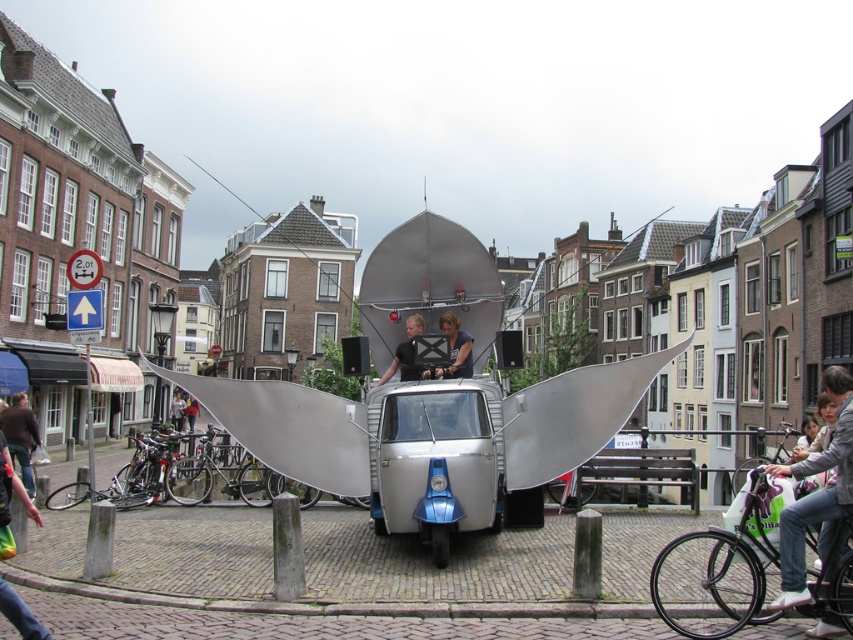
Question: Which object is farther from the camera taking this photo?

Choices:
 (A) black leather jacket at center
 (B) denim jeans at lower right
 (C) brushed metal bicycle at lower left
 (D) smooth silver wings at center

Answer: (A)

Question: Considering the relative positions of green matte bicycle at lower right and brushed metal bicycle at lower left in the image provided, where is green matte bicycle at lower right located with respect to brushed metal bicycle at lower left?

Choices:
 (A) above
 (B) below

Answer: (B)

Question: Which point appears closest to the camera in this image?

Choices:
 (A) 422,326
 (B) 698,589
 (C) 469,365
 (D) 4,525

Answer: (D)

Question: Can you confirm if green matte bicycle at lower right is positioned above light brown leather jacket at center?

Choices:
 (A) yes
 (B) no

Answer: (A)

Question: Which is farther from the denim jeans at lower right?

Choices:
 (A) black leather jacket at center
 (B) dark brown leather jacket at lower left
 (C) smooth silver wings at center

Answer: (B)

Question: Is green matte bicycle at lower right to the right of brushed metal bicycle at lower left from the viewer's perspective?

Choices:
 (A) yes
 (B) no

Answer: (A)